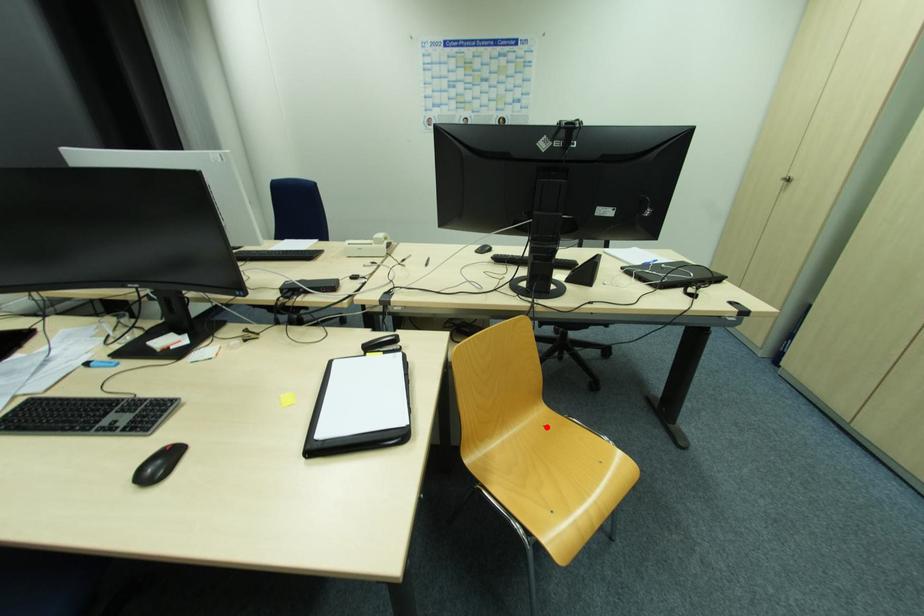
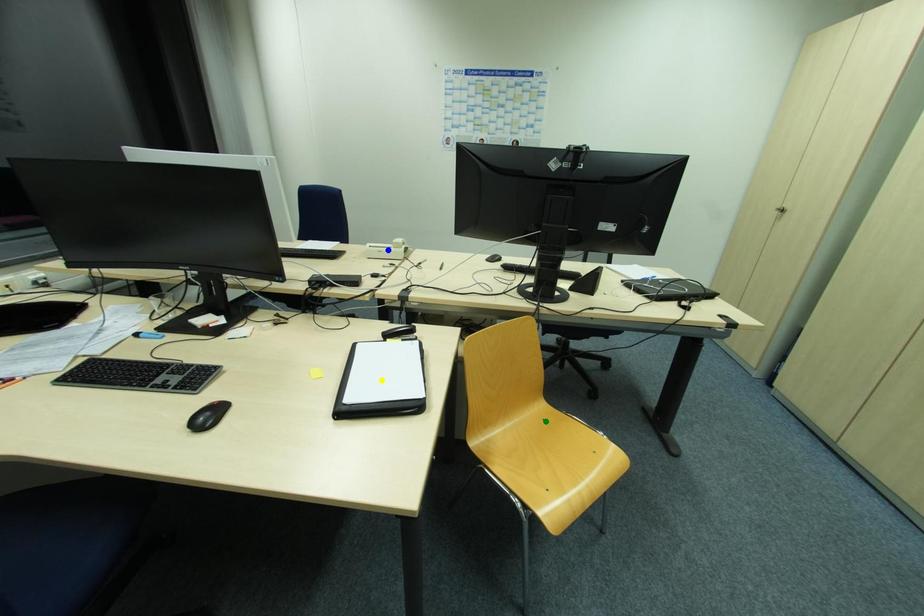
Question: I am providing you with two images of the same scene from different viewpoints. A red point is marked on the first image. You are given multiple points on the second image. Which point in image 2 represents the same 3d spot as the red point in image 1?

Choices:
 (A) yellow point
 (B) green point
 (C) blue point

Answer: (B)